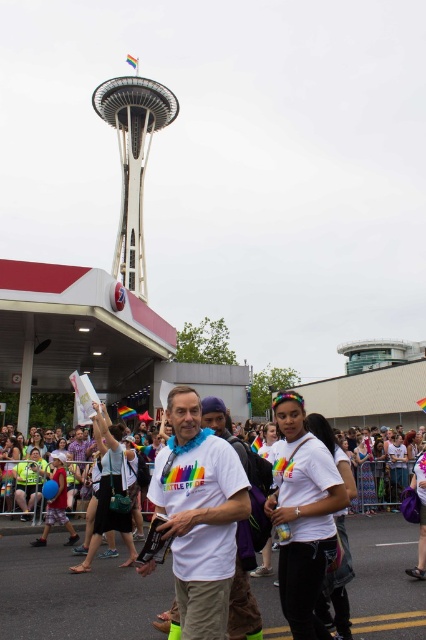
Question: Does white matte t-shirt at center appear over white glass space needle at upper center?

Choices:
 (A) no
 (B) yes

Answer: (A)

Question: Is white matte t-shirt at center closer to the viewer compared to white glass space needle at upper center?

Choices:
 (A) no
 (B) yes

Answer: (B)

Question: From the image, what is the correct spatial relationship of white matte t-shirt at center in relation to white glass space needle at upper center?

Choices:
 (A) above
 (B) below

Answer: (B)